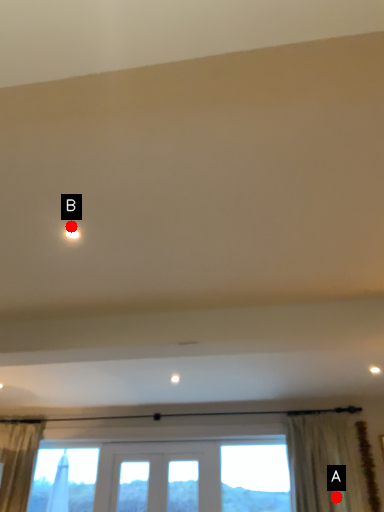
Question: Two points are circled on the image, labeled by A and B beside each circle. Which point is farther to the camera?

Choices:
 (A) A is further
 (B) B is further

Answer: (A)